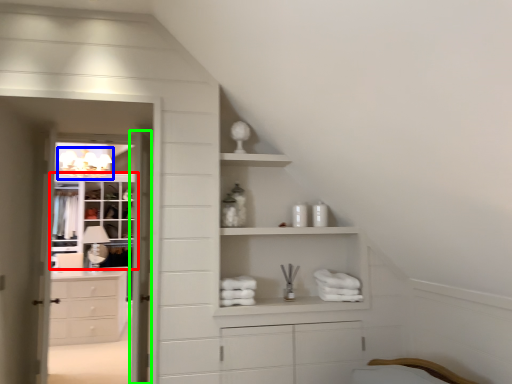
Question: Which object is the farthest from cupboard (highlighted by a red box)? Choose among these: light fixture (highlighted by a blue box) or door (highlighted by a green box).

Choices:
 (A) light fixture
 (B) door

Answer: (B)